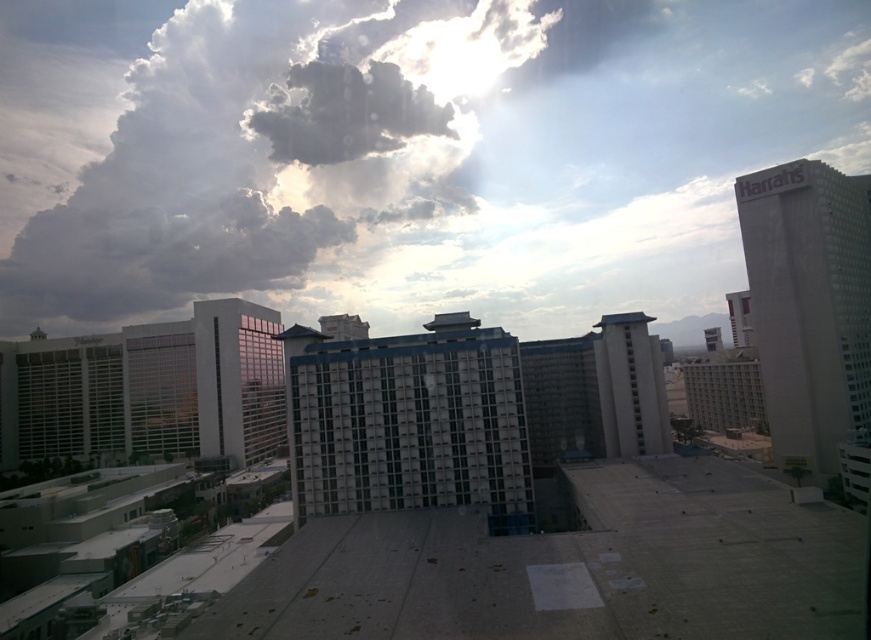
Who is higher up, gray concrete building at center or white textured building at center?

gray concrete building at center is higher up.

In order to click on gray concrete building at center in this screenshot , I will do `click(408, 422)`.

Where is `gray concrete building at center`? This screenshot has height=640, width=871. gray concrete building at center is located at coordinates (408, 422).

I want to click on gray concrete building at center, so click(408, 422).

Can you confirm if white fluffy cloud at upper center is bigger than gray concrete building at center?

Correct, white fluffy cloud at upper center is larger in size than gray concrete building at center.

Who is positioned more to the right, white fluffy cloud at upper center or gray concrete building at center?

Positioned to the right is white fluffy cloud at upper center.

Where is `white fluffy cloud at upper center`? white fluffy cloud at upper center is located at coordinates (404, 154).

Who is taller, white fluffy cloud at upper center or white textured building at center?

white fluffy cloud at upper center is taller.

Who is more forward, [674,289] or [696,381]?

Point [696,381]

Where is `white fluffy cloud at upper center`? white fluffy cloud at upper center is located at coordinates (404, 154).